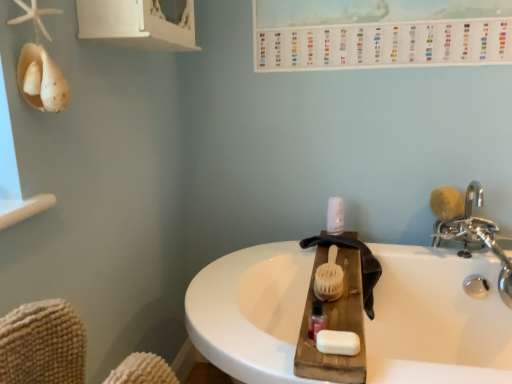
This screenshot has height=384, width=512. I want to click on free space between white bristle brush at center, the 2th brush when ordered from back to front, and pink glossy bottle at center, so click(326, 307).